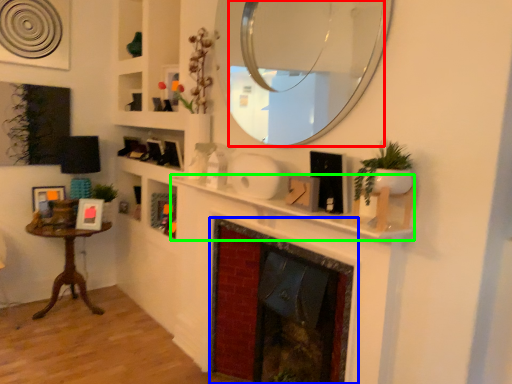
Question: Which is farther away from mirror (highlighted by a red box)? fireplace (highlighted by a blue box) or mantle (highlighted by a green box)?

Choices:
 (A) fireplace
 (B) mantle

Answer: (A)